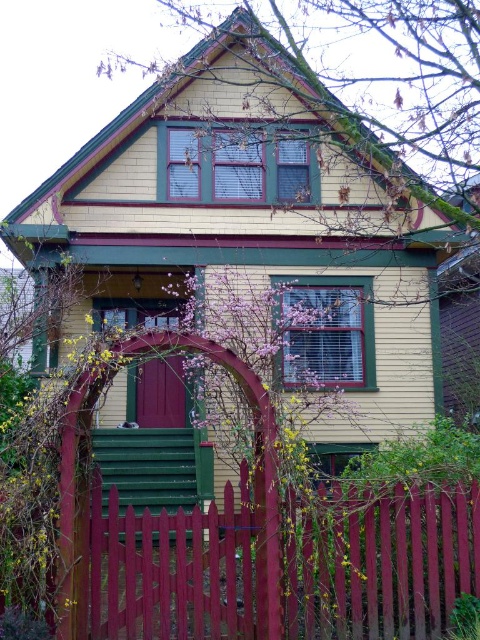
Question: Does smooth wooden fence at center appear on the right side of matte burgundy door at center?

Choices:
 (A) yes
 (B) no

Answer: (A)

Question: Which object is closer to the camera taking this photo?

Choices:
 (A) matte burgundy door at center
 (B) smooth wooden fence at center

Answer: (B)

Question: Considering the relative positions of smooth wooden fence at center and matte burgundy door at center in the image provided, where is smooth wooden fence at center located with respect to matte burgundy door at center?

Choices:
 (A) above
 (B) below

Answer: (B)

Question: Which of the following is the closest to the observer?

Choices:
 (A) smooth wooden fence at center
 (B) matte burgundy door at center

Answer: (A)

Question: Does smooth wooden fence at center have a smaller size compared to matte burgundy door at center?

Choices:
 (A) yes
 (B) no

Answer: (B)

Question: Which of the following is the farthest from the observer?

Choices:
 (A) matte burgundy door at center
 (B) smooth wooden fence at center

Answer: (A)